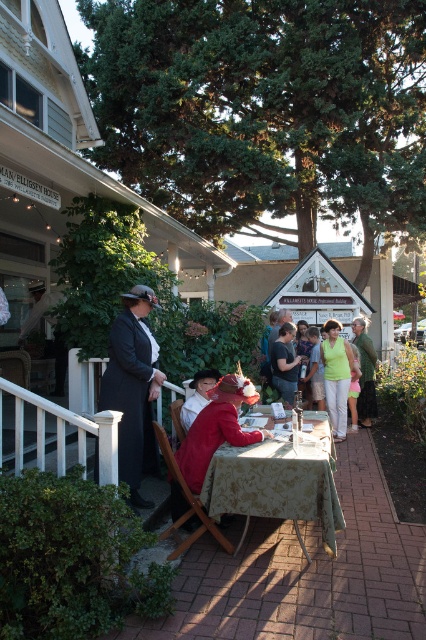
Question: Can you confirm if green floral tablecloth at center is positioned below matte red dress at center?

Choices:
 (A) no
 (B) yes

Answer: (B)

Question: Which point is closer to the camera taking this photo?

Choices:
 (A) (276, 342)
 (B) (360, 417)
 (C) (294, 508)

Answer: (C)

Question: Does green floral tablecloth at center appear under green fabric dress at lower right?

Choices:
 (A) no
 (B) yes

Answer: (B)

Question: Can you confirm if light green fabric at center is thinner than green fabric dress at lower right?

Choices:
 (A) yes
 (B) no

Answer: (B)

Question: Among these objects, which one is farthest from the camera?

Choices:
 (A) green floral tablecloth at center
 (B) matte black dress at left
 (C) green fabric dress at center

Answer: (C)

Question: Which is farther from the light green fabric at center?

Choices:
 (A) matte red dress at center
 (B) dark gray cotton shirt at center
 (C) green fabric dress at lower right

Answer: (A)